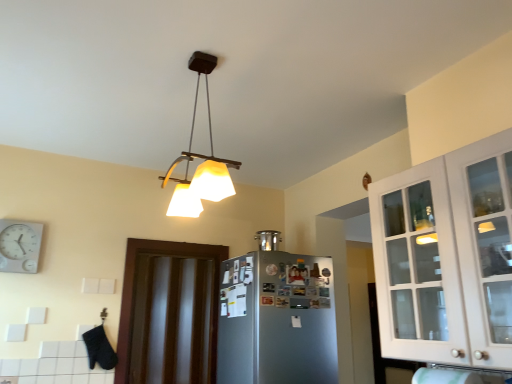
Question: From a real-world perspective, is matte white lampshade at upper center physically located above or below satin silver pot at upper center?

Choices:
 (A) below
 (B) above

Answer: (B)

Question: From the image's perspective, is matte white lampshade at upper center positioned above or below satin silver pot at upper center?

Choices:
 (A) above
 (B) below

Answer: (A)

Question: Estimate the real-world distances between objects in this image. Which object is farther from the matte white lampshade at upper center?

Choices:
 (A) white glass cabinet at upper right
 (B) dark wood door at center
 (C) satin silver pot at upper center
 (D) satin silver refrigerator at center
 (E) white plastic clock at upper left

Answer: (A)

Question: Which of these objects is positioned closest to the white glass cabinet at upper right?

Choices:
 (A) white plastic clock at upper left
 (B) matte white lampshade at upper center
 (C) satin silver pot at upper center
 (D) satin silver refrigerator at center
 (E) dark wood door at center

Answer: (D)